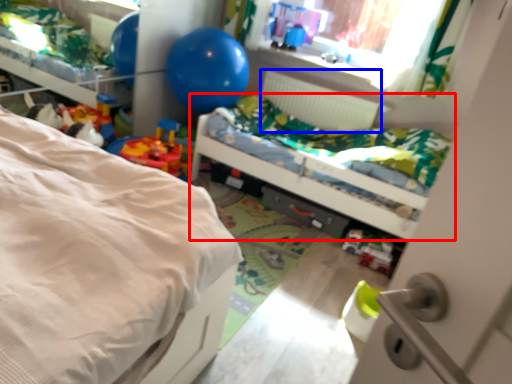
Question: Which object appears closest to the camera in this image, bed (highlighted by a red box) or radiator (highlighted by a blue box)?

Choices:
 (A) bed
 (B) radiator

Answer: (A)